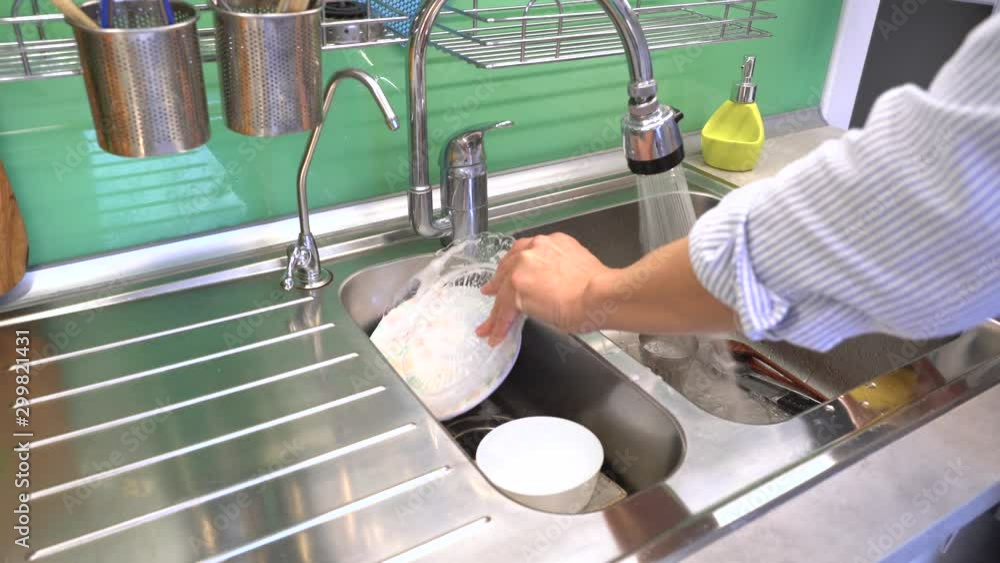
Image resolution: width=1000 pixels, height=563 pixels. I want to click on kitchen, so click(x=352, y=397).